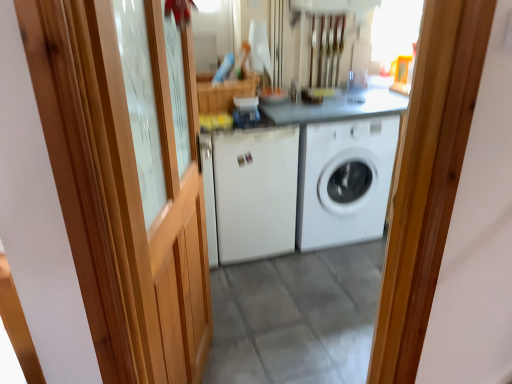
The image size is (512, 384). Describe the element at coordinates (344, 181) in the screenshot. I see `white matte washing machine at center, arranged as the second washing machine when viewed from the left` at that location.

Locate an element on the screen. wooden barn door at left is located at coordinates click(122, 192).

Is white matte washing machine at center, which is the 1th washing machine in left-to-right order, not inside wooden barn door at left?

white matte washing machine at center, which is the 1th washing machine in left-to-right order, is positioned outside wooden barn door at left.

Does white matte washing machine at center, which is the 1th washing machine in left-to-right order, have a lesser width compared to wooden barn door at left?

Incorrect, the width of white matte washing machine at center, which is the 1th washing machine in left-to-right order, is not less than that of wooden barn door at left.

From a real-world perspective, is white matte washing machine at center, which is the 1th washing machine in left-to-right order, beneath wooden barn door at left?

Correct, in the physical world, white matte washing machine at center, which is the 1th washing machine in left-to-right order, is lower than wooden barn door at left.

Does white matte washing machine at center, the 2th washing machine from the right, lie in front of wooden barn door at left?

No, the depth of white matte washing machine at center, the 2th washing machine from the right, is greater than that of wooden barn door at left.

From the image's perspective, is wooden barn door at left above white matte washing machine at center, the first washing machine positioned from the right?

No, from the image's perspective, wooden barn door at left is not above white matte washing machine at center, the first washing machine positioned from the right.

Is wooden barn door at left oriented away from white matte washing machine at center, the first washing machine positioned from the right?

No, wooden barn door at left is not facing the opposite direction of white matte washing machine at center, the first washing machine positioned from the right.

Between wooden barn door at left and white matte washing machine at center, the first washing machine positioned from the right, which one has larger width?

white matte washing machine at center, the first washing machine positioned from the right, is wider.

From a real-world perspective, is wooden barn door at left below white matte washing machine at center, the first washing machine positioned from the right?

Actually, wooden barn door at left is physically above white matte washing machine at center, the first washing machine positioned from the right, in the real world.

Which is behind, white matte washing machine at center, the first washing machine positioned from the right, or white matte washing machine at center, the 2th washing machine from the right?

white matte washing machine at center, the first washing machine positioned from the right, is further away from the camera.

From the image's perspective, is white matte washing machine at center, the first washing machine positioned from the right, positioned above or below white matte washing machine at center, the 2th washing machine from the right?

From the image's perspective, white matte washing machine at center, the first washing machine positioned from the right, appears above white matte washing machine at center, the 2th washing machine from the right.

Considering the relative sizes of white matte washing machine at center, arranged as the second washing machine when viewed from the left, and white matte washing machine at center, which is the 1th washing machine in left-to-right order, in the image provided, is white matte washing machine at center, arranged as the second washing machine when viewed from the left, smaller than white matte washing machine at center, which is the 1th washing machine in left-to-right order,?

Incorrect, white matte washing machine at center, arranged as the second washing machine when viewed from the left, is not smaller in size than white matte washing machine at center, which is the 1th washing machine in left-to-right order.

Where is `washing machine that appears below the white matte washing machine at center, the first washing machine positioned from the right (from the image's perspective)`? washing machine that appears below the white matte washing machine at center, the first washing machine positioned from the right (from the image's perspective) is located at coordinates (254, 193).

How different are the orientations of white matte washing machine at center, arranged as the second washing machine when viewed from the left, and wooden barn door at left in degrees?

white matte washing machine at center, arranged as the second washing machine when viewed from the left, and wooden barn door at left are facing 66.5 degrees away from each other.

Locate an element on the screen. the 2nd washing machine positioned above the wooden barn door at left (from the image's perspective) is located at coordinates (344, 181).

Between point (366, 193) and point (161, 145), which one is positioned in front?

The point (161, 145) is in front.

Is white matte washing machine at center, the first washing machine positioned from the right, not near wooden barn door at left?

Yes, white matte washing machine at center, the first washing machine positioned from the right, and wooden barn door at left are quite far apart.

Consider the image. Which point is more forward, (x=248, y=231) or (x=340, y=154)?

The point (x=340, y=154) is in front.

Considering the relative positions of white matte washing machine at center, which is the 1th washing machine in left-to-right order, and white matte washing machine at center, arranged as the second washing machine when viewed from the left, in the image provided, is white matte washing machine at center, which is the 1th washing machine in left-to-right order, behind white matte washing machine at center, arranged as the second washing machine when viewed from the left,?

No, it is not.

Who is taller, white matte washing machine at center, the 2th washing machine from the right, or white matte washing machine at center, the first washing machine positioned from the right?

white matte washing machine at center, the 2th washing machine from the right.

From the image's perspective, is white matte washing machine at center, which is the 1th washing machine in left-to-right order, positioned above or below white matte washing machine at center, arranged as the second washing machine when viewed from the left?

white matte washing machine at center, which is the 1th washing machine in left-to-right order, is situated lower than white matte washing machine at center, arranged as the second washing machine when viewed from the left, in the image.

Considering the relative positions of wooden barn door at left and white matte washing machine at center, which is the 1th washing machine in left-to-right order, in the image provided, is wooden barn door at left behind white matte washing machine at center, which is the 1th washing machine in left-to-right order,?

No, wooden barn door at left is closer to the camera.

In terms of width, does wooden barn door at left look wider or thinner when compared to white matte washing machine at center, which is the 1th washing machine in left-to-right order?

wooden barn door at left is thinner than white matte washing machine at center, which is the 1th washing machine in left-to-right order.

Is wooden barn door at left placed right next to white matte washing machine at center, the 2th washing machine from the right?

No, wooden barn door at left is not touching white matte washing machine at center, the 2th washing machine from the right.

From the image's perspective, is wooden barn door at left under white matte washing machine at center, which is the 1th washing machine in left-to-right order?

Yes.

The width and height of the screenshot is (512, 384). Identify the location of barn door located below the white matte washing machine at center, which is the 1th washing machine in left-to-right order (from the image's perspective). (122, 192).

There is a wooden barn door at left. Where is `the 1st washing machine below it (from a real-world perspective)`? The width and height of the screenshot is (512, 384). the 1st washing machine below it (from a real-world perspective) is located at coordinates coord(344,181).

Considering their positions, is white matte washing machine at center, the first washing machine positioned from the right, positioned closer to wooden barn door at left than white matte washing machine at center, which is the 1th washing machine in left-to-right order?

white matte washing machine at center, which is the 1th washing machine in left-to-right order, is positioned closer to the anchor wooden barn door at left.

From the image, which object appears to be farther from white matte washing machine at center, arranged as the second washing machine when viewed from the left, white matte washing machine at center, which is the 1th washing machine in left-to-right order, or wooden barn door at left?

Among the two, wooden barn door at left is located further to white matte washing machine at center, arranged as the second washing machine when viewed from the left.

When comparing their distances from white matte washing machine at center, the first washing machine positioned from the right, does wooden barn door at left or white matte washing machine at center, which is the 1th washing machine in left-to-right order, seem further?

wooden barn door at left is further to white matte washing machine at center, the first washing machine positioned from the right.

From the picture: Considering their positions, is wooden barn door at left positioned further to white matte washing machine at center, which is the 1th washing machine in left-to-right order, than white matte washing machine at center, the first washing machine positioned from the right?

wooden barn door at left is further to white matte washing machine at center, which is the 1th washing machine in left-to-right order.

When comparing their distances from white matte washing machine at center, the 2th washing machine from the right, does white matte washing machine at center, the first washing machine positioned from the right, or wooden barn door at left seem closer?

white matte washing machine at center, the first washing machine positioned from the right, is positioned closer to the anchor white matte washing machine at center, the 2th washing machine from the right.

Considering their positions, is white matte washing machine at center, which is the 1th washing machine in left-to-right order, positioned further to wooden barn door at left than white matte washing machine at center, the first washing machine positioned from the right?

white matte washing machine at center, the first washing machine positioned from the right, is positioned further to the anchor wooden barn door at left.

This screenshot has width=512, height=384. I want to click on washing machine between wooden barn door at left and white matte washing machine at center, arranged as the second washing machine when viewed from the left, from front to back, so click(x=254, y=193).